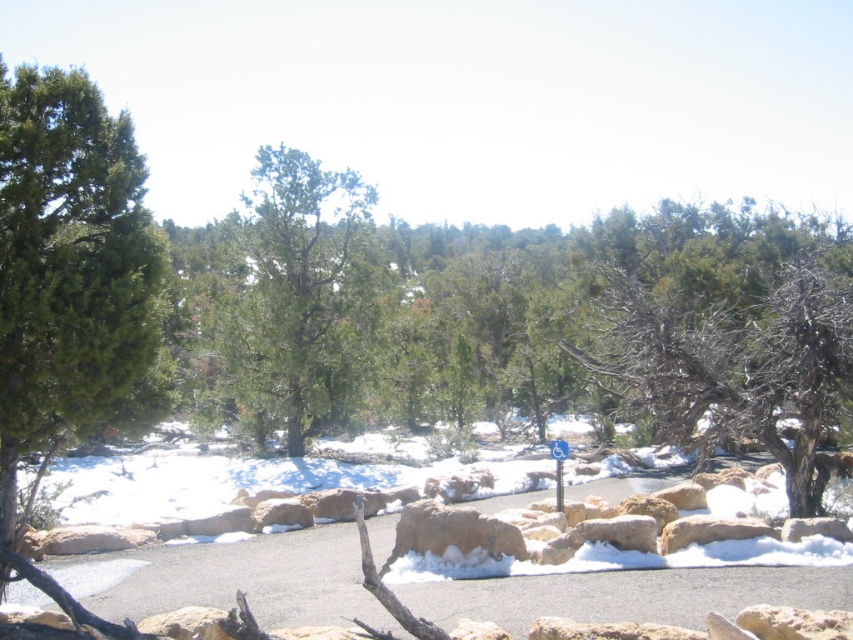
Question: Is green matte tree at left bigger than green matte tree at center?

Choices:
 (A) no
 (B) yes

Answer: (A)

Question: Among these objects, which one is nearest to the camera?

Choices:
 (A) green matte tree at center
 (B) green matte tree at left
 (C) blue plastic sign at center

Answer: (B)

Question: Which point is farther from the camera taking this photo?

Choices:
 (A) (561, 440)
 (B) (320, 250)
 (C) (138, 388)

Answer: (B)

Question: Is green matte tree at left positioned before blue plastic sign at center?

Choices:
 (A) no
 (B) yes

Answer: (B)

Question: Is green matte tree at center closer to the viewer compared to blue plastic sign at center?

Choices:
 (A) no
 (B) yes

Answer: (A)

Question: Considering the real-world distances, which object is farthest from the green matte tree at left?

Choices:
 (A) blue plastic sign at center
 (B) green matte tree at center

Answer: (B)